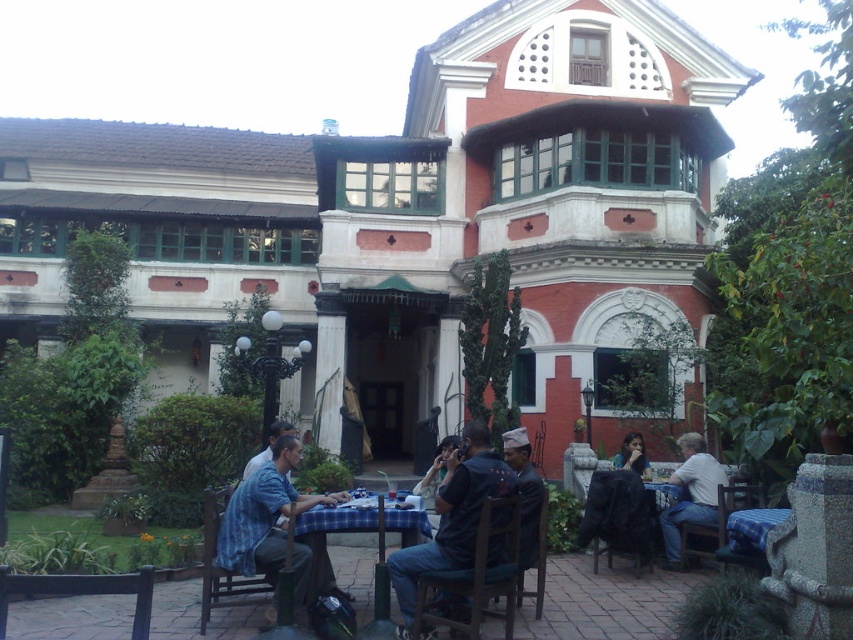
Is the position of blue plaid tablecloth at center more distant than that of light blue shirt at center?

No, it is in front of light blue shirt at center.

Does blue plaid tablecloth at center have a lesser height compared to light blue shirt at center?

Indeed, blue plaid tablecloth at center has a lesser height compared to light blue shirt at center.

Who is more forward, (294,536) or (695,460)?

Point (294,536) is in front.

I want to click on blue plaid tablecloth at center, so click(325, 538).

Between light blue shirt at center and matte black shirt at center, which one appears on the left side from the viewer's perspective?

matte black shirt at center

Is light blue shirt at center wider than matte black shirt at center?

Yes, light blue shirt at center is wider than matte black shirt at center.

Where is `light blue shirt at center`? This screenshot has height=640, width=853. light blue shirt at center is located at coordinates (x=691, y=493).

Which is in front, point (599, 512) or point (322, 556)?

Positioned in front is point (322, 556).

This screenshot has height=640, width=853. What are the coordinates of `blue fabric table at lower right` in the screenshot? It's located at (621, 515).

Which is in front, point (593, 516) or point (358, 528)?

Point (358, 528) is in front.

Identify the location of blue fabric table at lower right. The height and width of the screenshot is (640, 853). (621, 515).